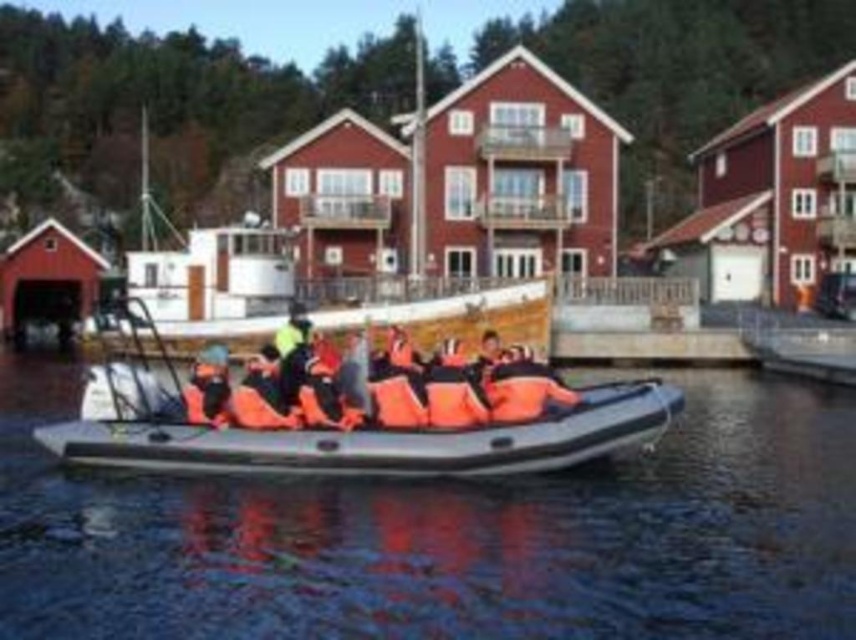
Question: Which point is closer to the camera taking this photo?

Choices:
 (A) (761, 388)
 (B) (330, 314)
 (C) (102, 422)

Answer: (C)

Question: Can you confirm if rubber boat at center is bigger than orange life vest at center?

Choices:
 (A) yes
 (B) no

Answer: (A)

Question: In this image, where is rubber boat at center located relative to orange life vest at center?

Choices:
 (A) right
 (B) left

Answer: (B)

Question: Does rubber boat at center appear on the left side of orange life vest at center?

Choices:
 (A) no
 (B) yes

Answer: (B)

Question: Estimate the real-world distances between objects in this image. Which object is farther from the rubber boat at center?

Choices:
 (A) orange life vest at center
 (B) black rubber boat at center

Answer: (B)

Question: Which point appears farthest from the camera in this image?

Choices:
 (A) (502, 435)
 (B) (1, 518)

Answer: (A)